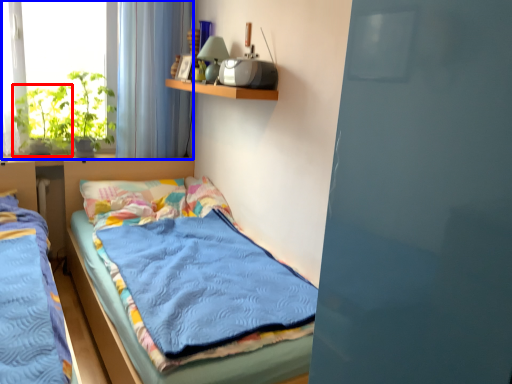
Question: Which object is closer to the camera taking this photo, plant (highlighted by a red box) or window (highlighted by a blue box)?

Choices:
 (A) plant
 (B) window

Answer: (B)